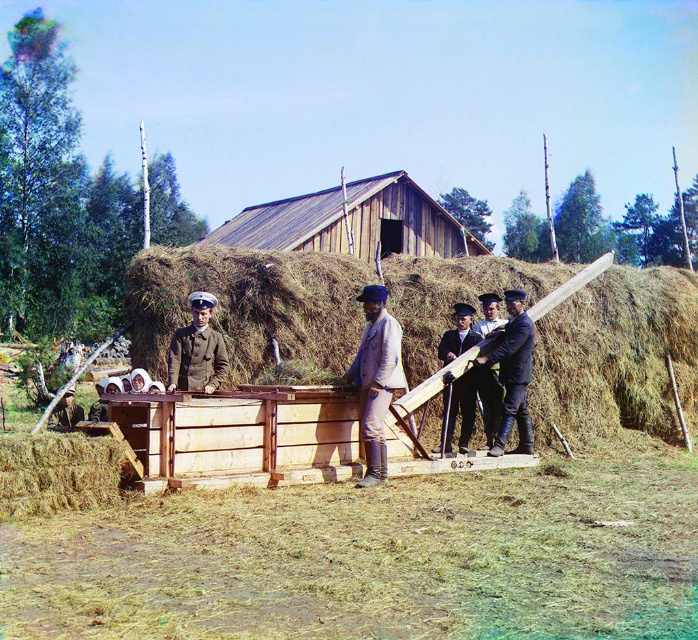
Question: Is dark blue uniform at center thinner than dark brown uniform at center?

Choices:
 (A) yes
 (B) no

Answer: (B)

Question: Which point is closer to the camera?

Choices:
 (A) brown straw at center
 (B) brown uniform at center
 (C) dark brown uniform at center
 (D) yellow straw bale at lower left

Answer: (D)

Question: Which object is positioned closest to the dark brown uniform at center?

Choices:
 (A) brown uniform at center
 (B) brown leather hat at lower left
 (C) brown straw at center
 (D) dark blue uniform at center

Answer: (D)

Question: Which object appears farthest from the camera in this image?

Choices:
 (A) light brown leather jacket at center
 (B) yellow straw bale at lower left
 (C) dark blue uniform at center

Answer: (C)

Question: Is brown straw at center positioned before light brown leather jacket at center?

Choices:
 (A) yes
 (B) no

Answer: (B)

Question: Is brown straw at center thinner than brown uniform at center?

Choices:
 (A) yes
 (B) no

Answer: (B)